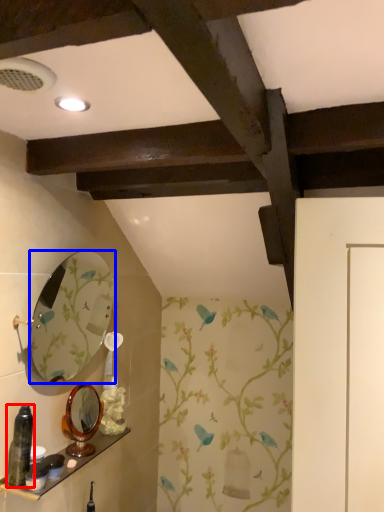
Question: Which of the following is the closest to the observer, bottle (highlighted by a red box) or mirror (highlighted by a blue box)?

Choices:
 (A) bottle
 (B) mirror

Answer: (A)